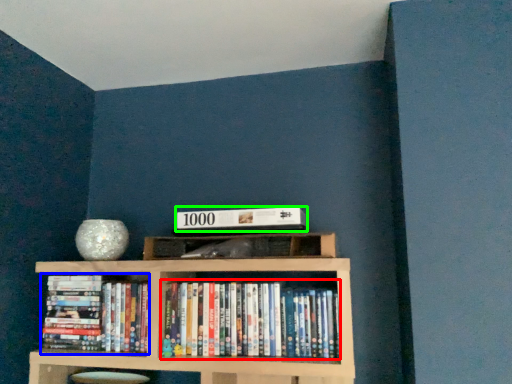
Question: Which object is positioned farthest from book (highlighted by a red box)? Select from book (highlighted by a blue box) and paperback book (highlighted by a green box).

Choices:
 (A) book
 (B) paperback book

Answer: (A)